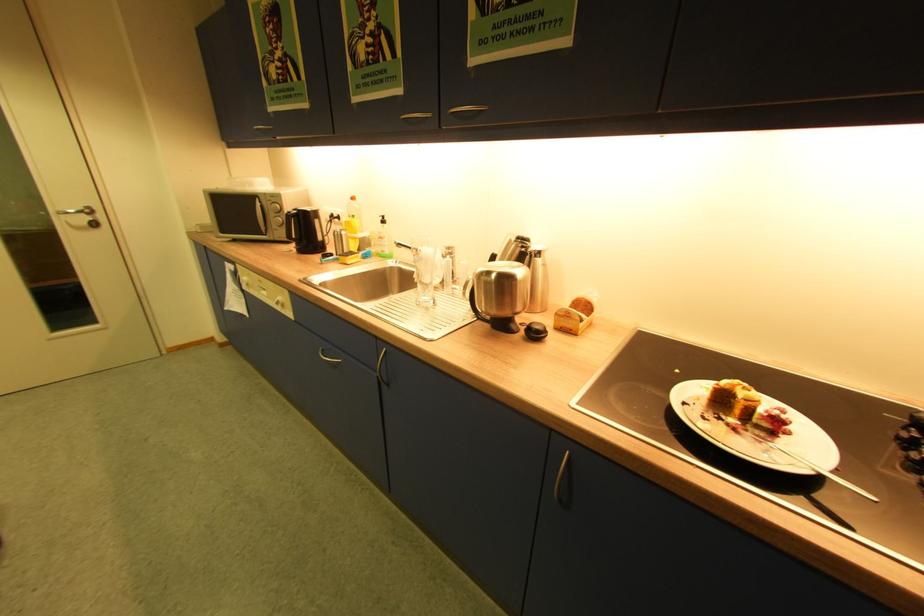
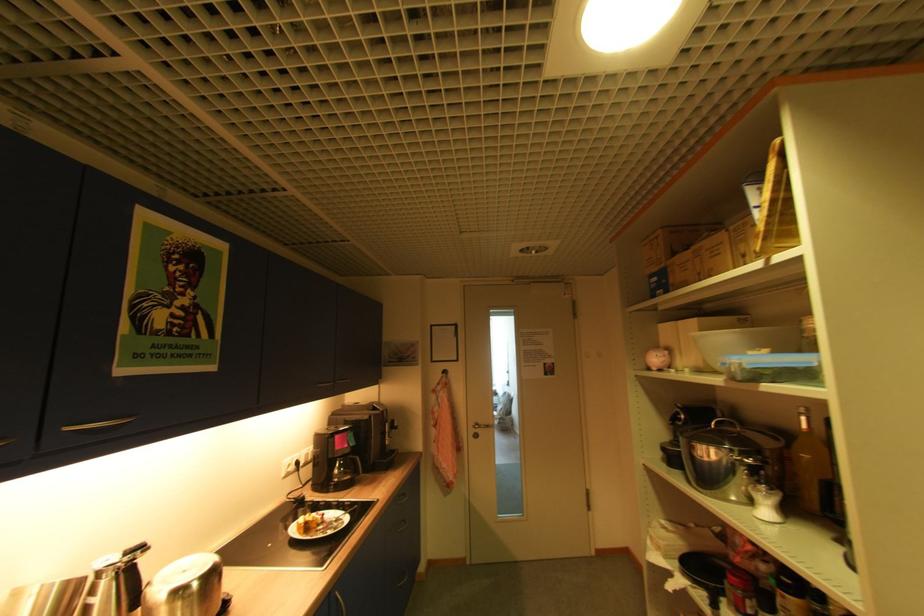
Locate, in the second image, the point that corresponds to point 543,261 in the first image.

(128, 572)